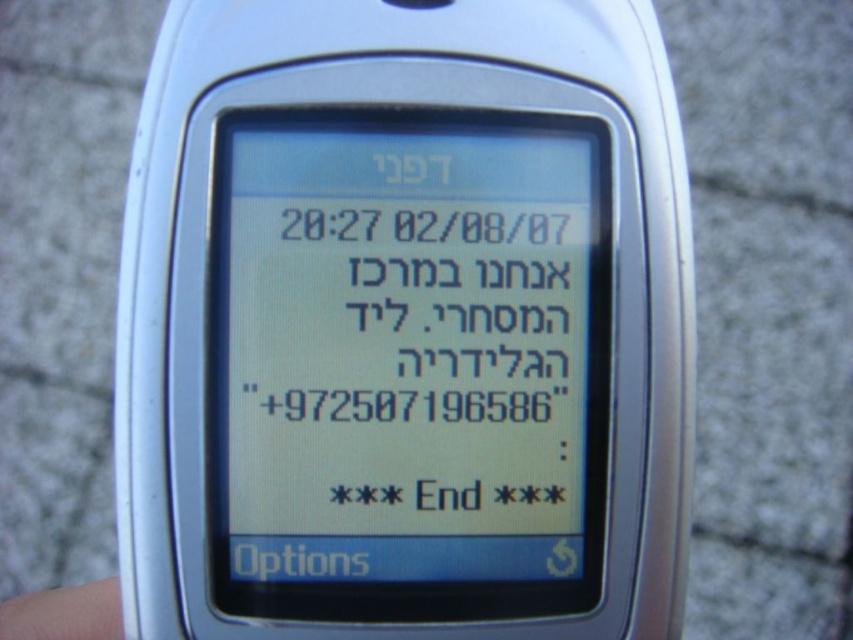
Is silver metallic phone at center in front of skin smooth finger at lower left?

Yes, silver metallic phone at center is in front of skin smooth finger at lower left.

Is silver metallic phone at center thinner than skin smooth finger at lower left?

Incorrect, silver metallic phone at center's width is not less than skin smooth finger at lower left's.

Locate an element on the screen. silver metallic phone at center is located at coordinates (405, 324).

Is white matte text message at center positioned behind skin smooth finger at lower left?

No, it is in front of skin smooth finger at lower left.

Measure the distance between white matte text message at center and camera.

They are 68.21 centimeters apart.

Find the location of a particular element. white matte text message at center is located at coordinates (405, 364).

Can you confirm if silver metallic phone at center is shorter than white matte text message at center?

In fact, silver metallic phone at center may be taller than white matte text message at center.

Does silver metallic phone at center have a greater height compared to white matte text message at center?

Indeed, silver metallic phone at center has a greater height compared to white matte text message at center.

I want to click on silver metallic phone at center, so click(x=405, y=324).